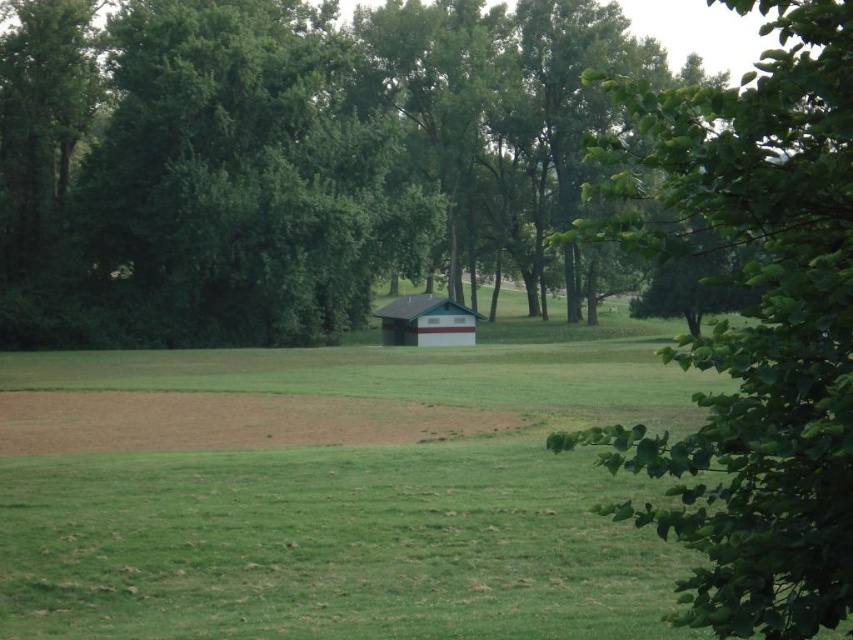
Locate an element on the screen. The width and height of the screenshot is (853, 640). green leafy tree at center right is located at coordinates (747, 321).

Between point (828, 401) and point (404, 337), which one is positioned behind?

Positioned behind is point (404, 337).

What do you see at coordinates (747, 321) in the screenshot? I see `green leafy tree at center right` at bounding box center [747, 321].

You are a GUI agent. You are given a task and a screenshot of the screen. Output one action in this format:
    pyautogui.click(x=<x>, y=<y>)
    Task: Click on the green leafy tree at center right
    
    Given the screenshot: What is the action you would take?
    pyautogui.click(x=747, y=321)

Who is more distant from viewer, (410, 16) or (761, 86)?

→ Positioned behind is point (410, 16).

Is green leafy tree at center to the left of green leafy tree at center right from the viewer's perspective?

Correct, you'll find green leafy tree at center to the left of green leafy tree at center right.

Which is in front, point (328, 212) or point (786, 456)?

Point (786, 456) is more forward.

The height and width of the screenshot is (640, 853). I want to click on green leafy tree at center, so click(292, 161).

Who is lower down, green leafy tree at center or green shingled barn at center?

green shingled barn at center is below.

Can you confirm if green leafy tree at center is shorter than green shingled barn at center?

Incorrect, green leafy tree at center's height does not fall short of green shingled barn at center's.

Does point (286, 173) come closer to viewer compared to point (445, 323)?

That is True.

I want to click on green leafy tree at center, so click(292, 161).